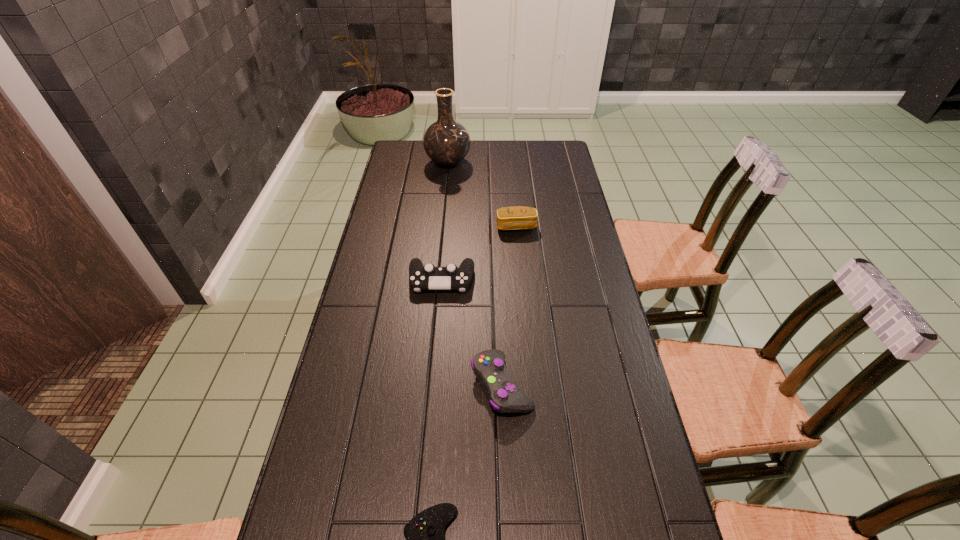
This screenshot has width=960, height=540. I want to click on the third closest object relative to the clutch bag, so click(504, 395).

Where is `the third closest control relative to the tallest object`? the third closest control relative to the tallest object is located at coordinates (424, 534).

What are the coordinates of `control that stands as the closest to the vase` in the screenshot? It's located at (428, 277).